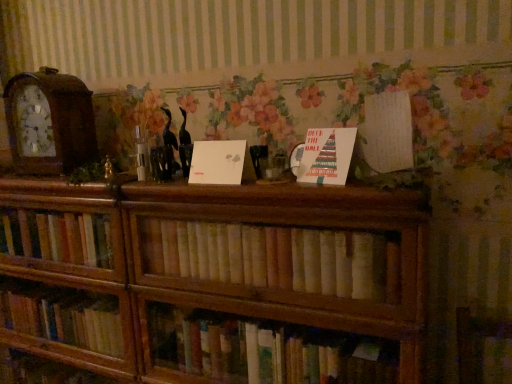
Question: From a real-world perspective, is white paper at center, the third paperback book when ordered from right to left, physically located above or below wooden clock at left?

Choices:
 (A) below
 (B) above

Answer: (A)

Question: Considering the relative positions of white paper at center, the third paperback book when ordered from right to left, and wooden clock at left in the image provided, is white paper at center, the third paperback book when ordered from right to left, to the left or to the right of wooden clock at left?

Choices:
 (A) left
 (B) right

Answer: (B)

Question: Which of these objects is positioned farthest from the wooden bookcase at center?

Choices:
 (A) white paper at upper right, the 1th paperback book when ordered from right to left
 (B) white paper at center, the third paperback book when ordered from right to left
 (C) light brown wooden bookshelf at center
 (D) white paper at center, which ranks as the 2th paperback book in left-to-right order
 (E) wooden clock at left

Answer: (A)

Question: Considering the real-world distances, which object is closest to the white paper at upper right, the third paperback book from the left?

Choices:
 (A) white paper at center, positioned as the first paperback book in left-to-right order
 (B) wooden clock at left
 (C) white paper at center, which ranks as the 2th paperback book in left-to-right order
 (D) wooden bookcase at center
 (E) light brown wooden bookshelf at center

Answer: (C)